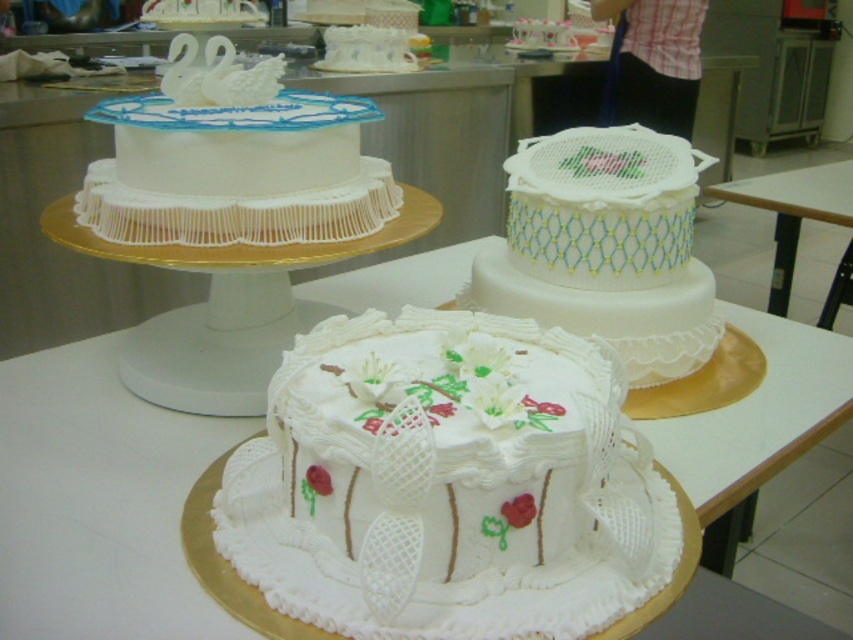
Who is lower down, white fondant cake at center or wooden table at center?

white fondant cake at center is lower down.

Identify the location of white fondant cake at center. The height and width of the screenshot is (640, 853). (447, 483).

Is white cake at center wider than white fondant cake at upper center?

Correct, the width of white cake at center exceeds that of white fondant cake at upper center.

Does white cake at center come in front of white fondant cake at upper center?

That is True.

Is point (0, 621) in front of point (231, 4)?

Yes, point (0, 621) is closer to viewer.

Image resolution: width=853 pixels, height=640 pixels. In order to click on white cake at center in this screenshot , I will do `click(99, 502)`.

Describe the element at coordinates (99, 502) in the screenshot. I see `white cake at center` at that location.

Between white cake at center and white lace cake at center, which one has less height?

white cake at center

What do you see at coordinates (99, 502) in the screenshot? The height and width of the screenshot is (640, 853). I see `white cake at center` at bounding box center [99, 502].

Where is `white cake at center`? white cake at center is located at coordinates (99, 502).